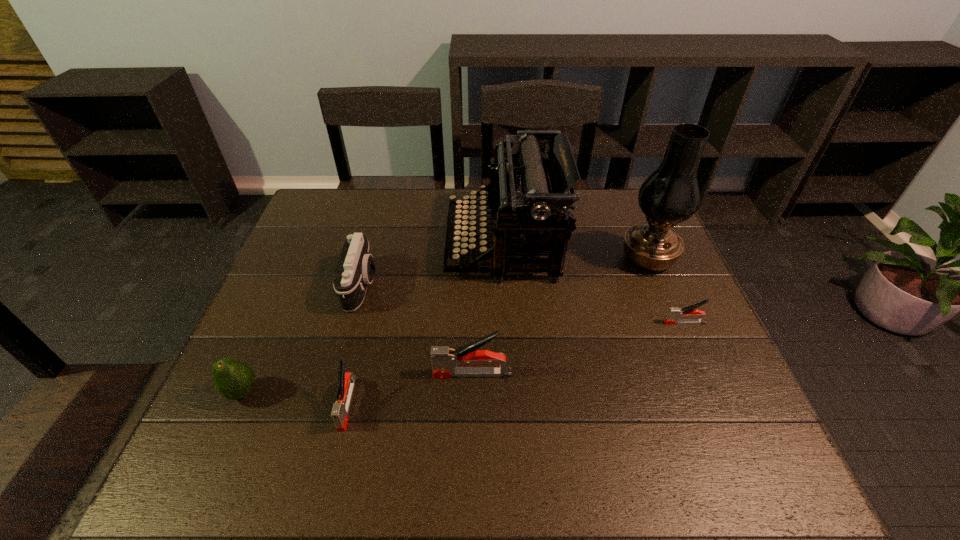
What are the coordinates of `object at the far edge` in the screenshot? It's located at (527, 196).

Locate an element on the screen. stapler that is at the near edge is located at coordinates (346, 381).

What are the coordinates of `avocado present at the near edge` in the screenshot? It's located at (234, 379).

Where is `object that is at the left edge`? This screenshot has height=540, width=960. object that is at the left edge is located at coordinates (234, 379).

Where is `stapler that is at the right edge`? This screenshot has width=960, height=540. stapler that is at the right edge is located at coordinates (674, 313).

Image resolution: width=960 pixels, height=540 pixels. In order to click on oil lamp that is at the right edge in this screenshot , I will do `click(671, 195)`.

The height and width of the screenshot is (540, 960). I want to click on object that is at the near left corner, so click(x=234, y=379).

Image resolution: width=960 pixels, height=540 pixels. Identify the location of free space at the far edge of the desktop. (589, 227).

Where is `free space at the left edge of the desktop`? The width and height of the screenshot is (960, 540). free space at the left edge of the desktop is located at coordinates (301, 364).

Where is `vacant space at the right edge`? This screenshot has height=540, width=960. vacant space at the right edge is located at coordinates (696, 301).